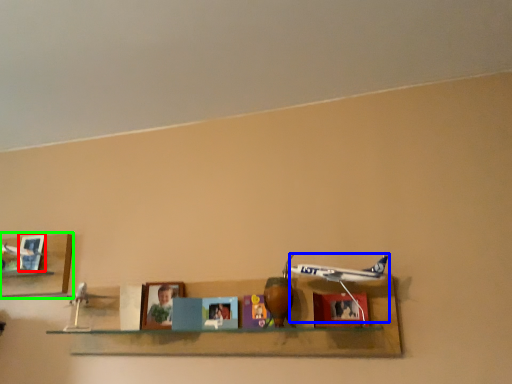
Question: Which object is the closest to the picture frame (highlighted by a red box)? Choose among these: plane (highlighted by a blue box) or shelf (highlighted by a green box).

Choices:
 (A) plane
 (B) shelf

Answer: (B)